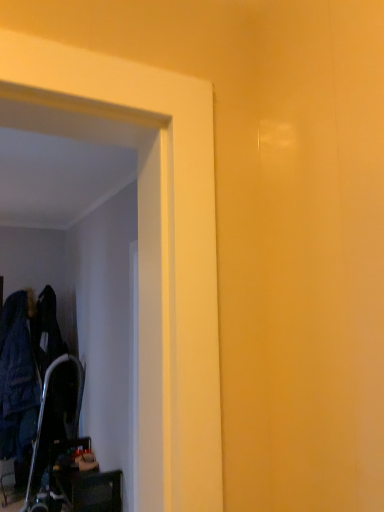
In order to face metallic silver baby carriage at lower left, should I rotate leftwards or rightwards?

Turn left by 18.472 degrees to look at metallic silver baby carriage at lower left.

What do you see at coordinates (44, 408) in the screenshot? The image size is (384, 512). I see `metallic silver baby carriage at lower left` at bounding box center [44, 408].

Where is `metallic silver baby carriage at lower left`? metallic silver baby carriage at lower left is located at coordinates (44, 408).

You are a GUI agent. You are given a task and a screenshot of the screen. Output one action in this format:
    pyautogui.click(x=<x>, y=<y>)
    Task: Click on the metallic silver baby carriage at lower left
    This screenshot has width=384, height=512.
    Given the screenshot: What is the action you would take?
    pyautogui.click(x=44, y=408)